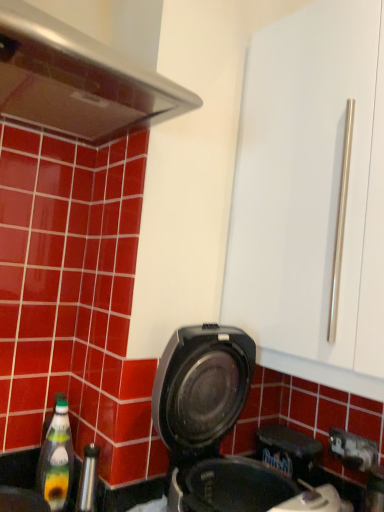
Question: Should I look upward or downward to see black plastic waffle maker at lower center?

Choices:
 (A) up
 (B) down

Answer: (B)

Question: From a real-world perspective, is green glass bottle at lower left on transparent plastic bottle at lower left?

Choices:
 (A) yes
 (B) no

Answer: (A)

Question: Considering the relative positions of green glass bottle at lower left and transparent plastic bottle at lower left in the image provided, is green glass bottle at lower left in front of transparent plastic bottle at lower left?

Choices:
 (A) yes
 (B) no

Answer: (B)

Question: Is green glass bottle at lower left aimed at transparent plastic bottle at lower left?

Choices:
 (A) no
 (B) yes

Answer: (A)

Question: Is green glass bottle at lower left surrounding transparent plastic bottle at lower left?

Choices:
 (A) no
 (B) yes

Answer: (A)

Question: Would you say green glass bottle at lower left is a long distance from transparent plastic bottle at lower left?

Choices:
 (A) no
 (B) yes

Answer: (A)

Question: Is green glass bottle at lower left further to camera compared to transparent plastic bottle at lower left?

Choices:
 (A) yes
 (B) no

Answer: (A)

Question: Is black plastic waffle maker at lower center inside transparent plastic bottle at lower left?

Choices:
 (A) yes
 (B) no

Answer: (B)

Question: Is transparent plastic bottle at lower left wider than black plastic waffle maker at lower center?

Choices:
 (A) yes
 (B) no

Answer: (B)

Question: From a real-world perspective, is transparent plastic bottle at lower left physically below black plastic waffle maker at lower center?

Choices:
 (A) no
 (B) yes

Answer: (B)

Question: Can you confirm if transparent plastic bottle at lower left is taller than black plastic waffle maker at lower center?

Choices:
 (A) no
 (B) yes

Answer: (A)

Question: Is there a large distance between transparent plastic bottle at lower left and black plastic waffle maker at lower center?

Choices:
 (A) yes
 (B) no

Answer: (B)

Question: Is transparent plastic bottle at lower left oriented towards black plastic waffle maker at lower center?

Choices:
 (A) no
 (B) yes

Answer: (A)

Question: From a real-world perspective, is black plastic waffle maker at lower center on top of transparent plastic bottle at lower left?

Choices:
 (A) yes
 (B) no

Answer: (A)